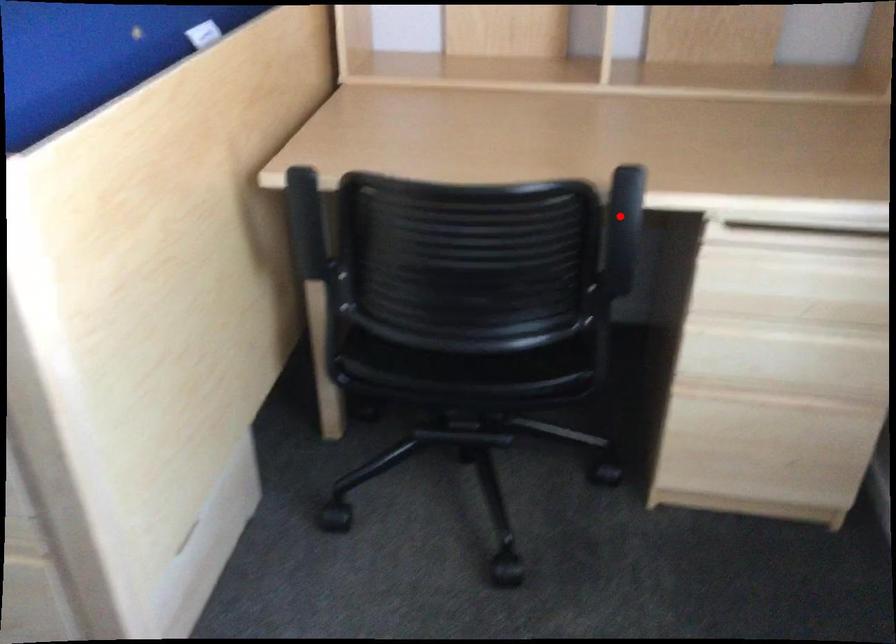
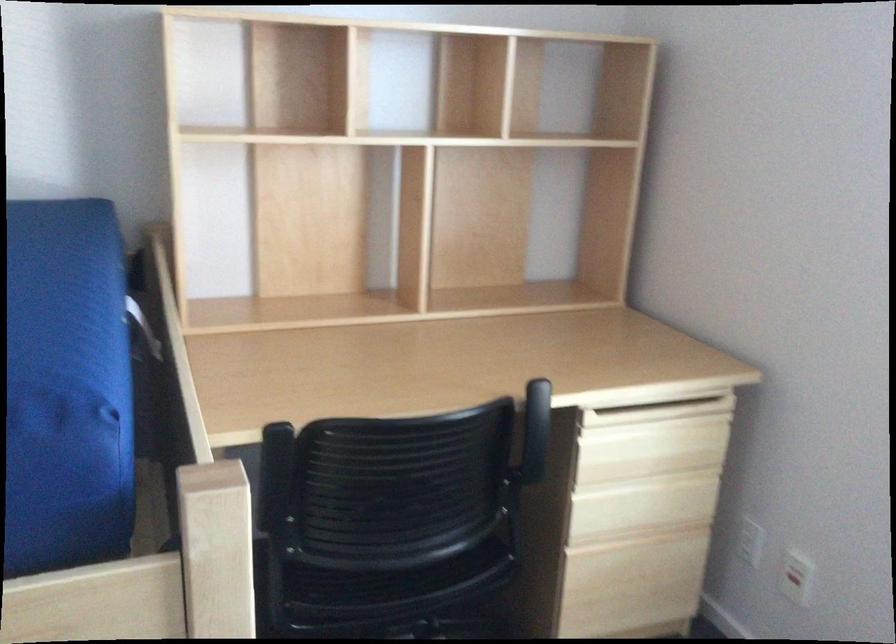
Find the pixel in the second image that matches the highlighted location in the first image.

(536, 417)